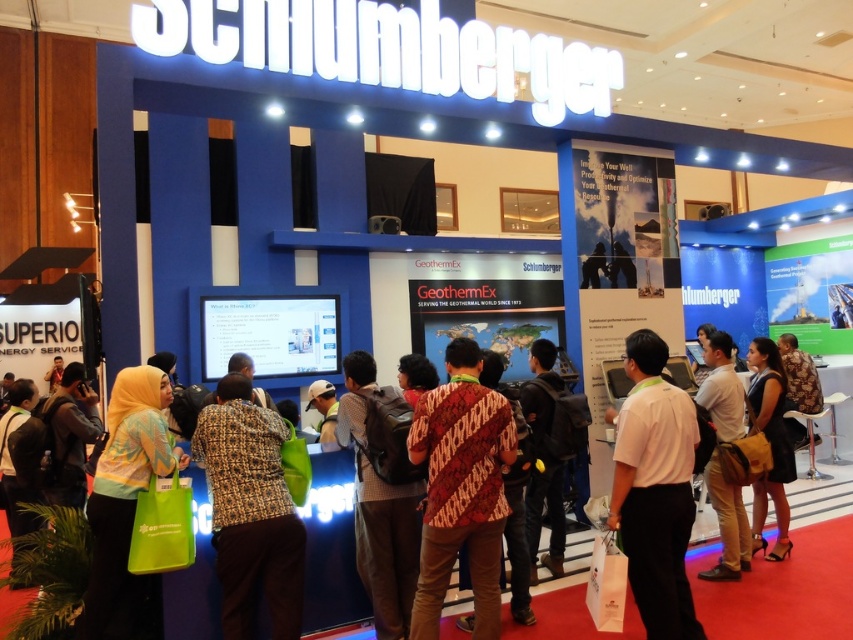
Question: Can you confirm if printed fabric shirt at center is positioned to the right of white shirt at center?

Choices:
 (A) no
 (B) yes

Answer: (A)

Question: Is white shirt at center above brown woven backpack at center?

Choices:
 (A) yes
 (B) no

Answer: (A)

Question: Which object is closer to the camera taking this photo?

Choices:
 (A) printed fabric shirt at center
 (B) black leather dress at center
 (C) white shirt at center
 (D) tan fabric shirt at center

Answer: (A)

Question: Which point is closer to the camera?

Choices:
 (A) (265, 435)
 (B) (502, 419)
 (C) (322, 387)
 (D) (688, 435)

Answer: (B)

Question: Does printed fabric shirt at center appear under brown woven backpack at center?

Choices:
 (A) yes
 (B) no

Answer: (A)

Question: Based on their relative distances, which object is farther from the dark brown leather backpack at center?

Choices:
 (A) printed fabric shirt at center
 (B) brown woven backpack at center
 (C) white shirt at center

Answer: (A)